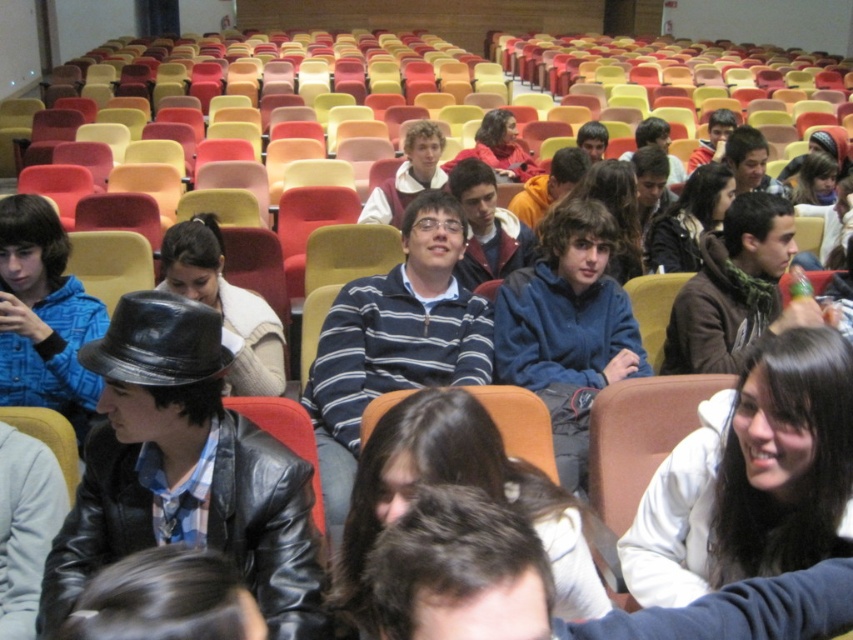
Does striped knit sweater at center appear over matte blue jacket at center?

Actually, striped knit sweater at center is below matte blue jacket at center.

Looking at this image, does striped knit sweater at center lie in front of matte blue jacket at center?

Yes.

Where is `striped knit sweater at center`? striped knit sweater at center is located at coordinates (393, 340).

From the picture: Does brown fleece jacket at center-right have a lesser height compared to striped sweater at center?

No, brown fleece jacket at center-right is not shorter than striped sweater at center.

Measure the distance between point [750,250] and camera.

9.81 feet

Locate an element on the screen. brown fleece jacket at center-right is located at coordinates (735, 289).

Between leather hat at center and striped sweater at center, which one is positioned lower?

leather hat at center is below.

Between leather hat at center and striped sweater at center, which one has more height?

With more height is leather hat at center.

Locate an element on the screen. leather hat at center is located at coordinates (x=44, y=316).